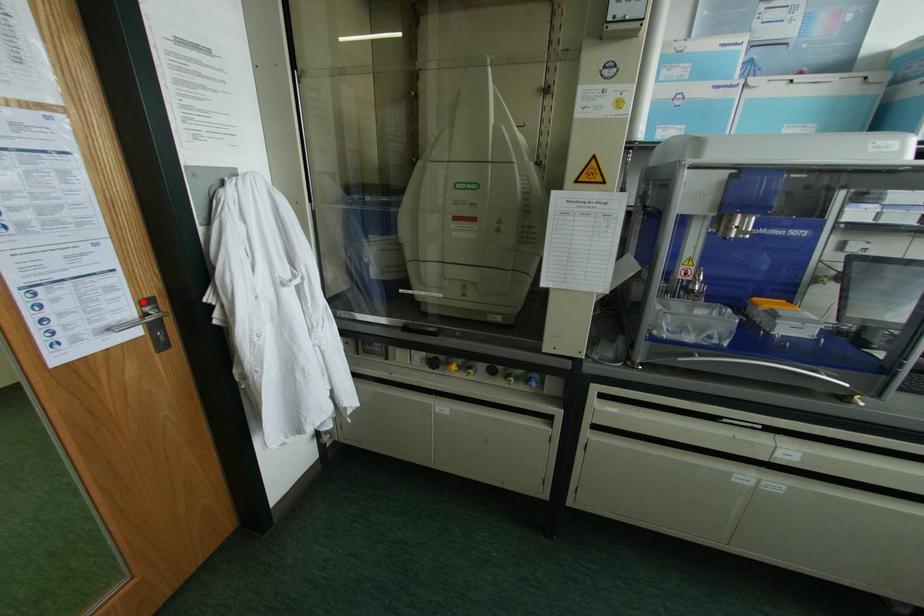
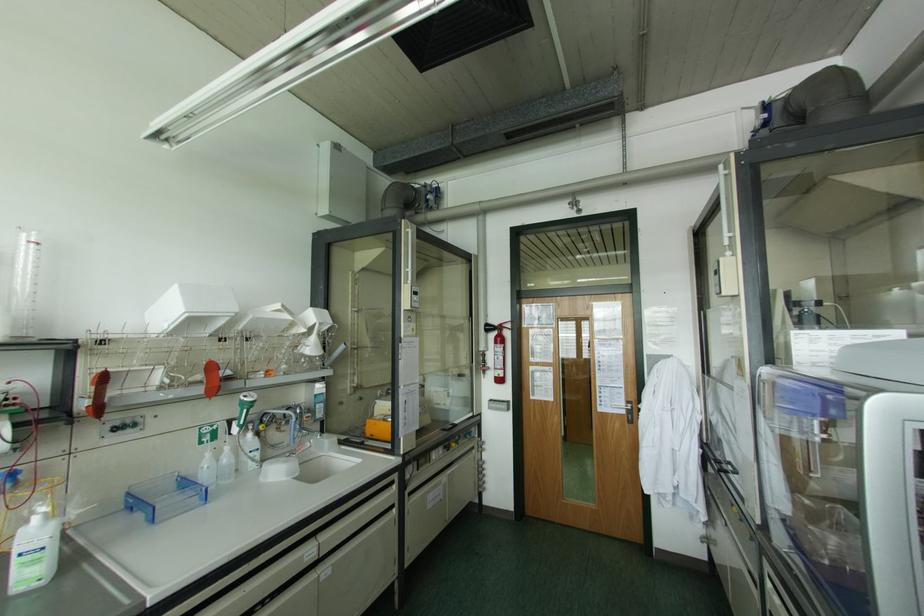
Locate, in the second image, the point that corresponds to the highlighted location in the first image.

(626, 400)